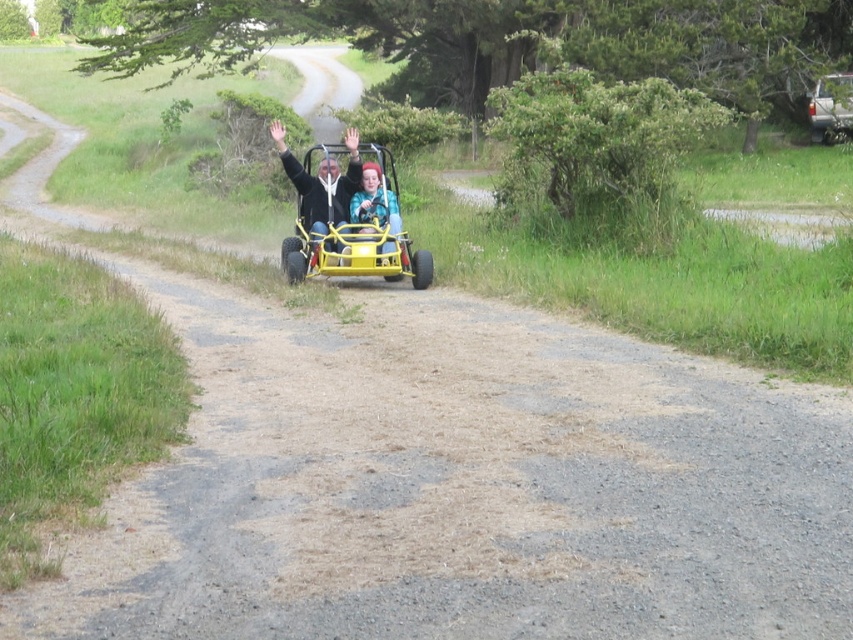
You are a photographer positioned at the starting point of the gravel road. You want to capture a photo of the matte black jacket at center and the silver metallic truck at upper right in the same frame. Which object should you focus on first to ensure both are in focus?

You should focus on the matte black jacket at center first because it is closer to you than the silver metallic truck at upper right, so focusing on the closer object will ensure both are in focus.